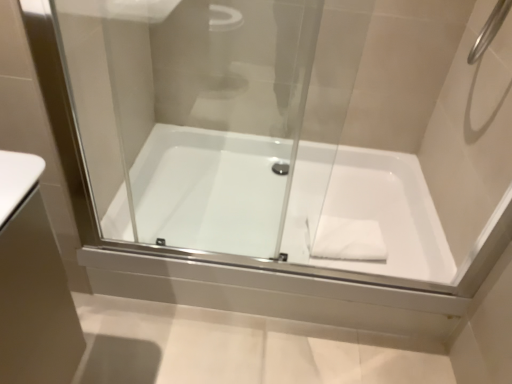
Question: Can you confirm if transparent glass door at center is bigger than white glossy bathtub at center?

Choices:
 (A) no
 (B) yes

Answer: (A)

Question: Would you say transparent glass door at center is a long distance from white glossy bathtub at center?

Choices:
 (A) no
 (B) yes

Answer: (A)

Question: Is white glossy bathtub at center at the back of transparent glass door at center?

Choices:
 (A) no
 (B) yes

Answer: (B)

Question: Are transparent glass door at center and white glossy bathtub at center making contact?

Choices:
 (A) no
 (B) yes

Answer: (A)

Question: Is transparent glass door at center oriented towards white glossy bathtub at center?

Choices:
 (A) no
 (B) yes

Answer: (A)

Question: Is white matte hand towel at center to the left or to the right of white glossy bathtub at center in the image?

Choices:
 (A) right
 (B) left

Answer: (A)

Question: Looking at the image, does white matte hand towel at center seem bigger or smaller compared to white glossy bathtub at center?

Choices:
 (A) small
 (B) big

Answer: (A)

Question: Is white matte hand towel at center situated inside white glossy bathtub at center or outside?

Choices:
 (A) inside
 (B) outside

Answer: (A)

Question: Relative to white glossy bathtub at center, is white matte hand towel at center in front or behind?

Choices:
 (A) behind
 (B) front

Answer: (A)

Question: Would you say white matte hand towel at center is inside or outside transparent glass door at center?

Choices:
 (A) inside
 (B) outside

Answer: (B)

Question: From the image's perspective, is white matte hand towel at center positioned above or below transparent glass door at center?

Choices:
 (A) below
 (B) above

Answer: (A)

Question: Based on their positions, is white matte hand towel at center located to the left or right of transparent glass door at center?

Choices:
 (A) left
 (B) right

Answer: (B)

Question: Is point (350, 223) positioned closer to the camera than point (135, 9)?

Choices:
 (A) farther
 (B) closer

Answer: (A)

Question: Considering the positions of transparent glass door at center and white glossy bathtub at center in the image, is transparent glass door at center bigger or smaller than white glossy bathtub at center?

Choices:
 (A) small
 (B) big

Answer: (A)

Question: In terms of width, does transparent glass door at center look wider or thinner when compared to white glossy bathtub at center?

Choices:
 (A) thin
 (B) wide

Answer: (A)